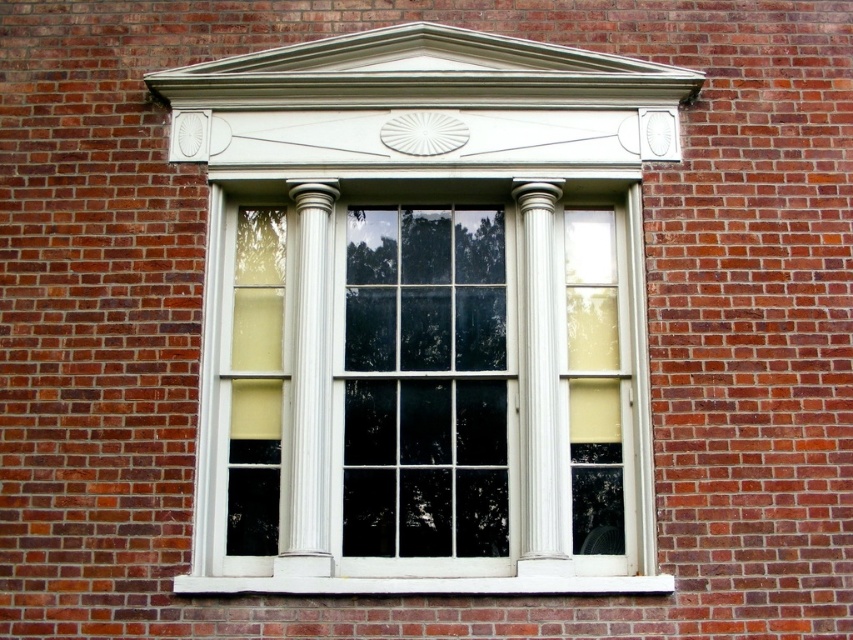
You are a painter standing on a ladder trying to paint the white glossy wood bay window at center and the white painted wood at lower center. The ladder can only reach up to 12 feet. Can you paint both areas without moving the ladder?

The distance between the white glossy wood bay window at center and the white painted wood at lower center is 13.78 feet, which exceeds the ladder height of 12 feet. Therefore, you cannot paint both areas without moving the ladder.

Looking at this image, you are standing at the camera position and want to take a photo of the white glossy wood bay window at center. If your camera has a maximum focus range of 70 feet, will you be able to focus on the window?

The distance between the white glossy wood bay window at center and the camera is 77.34 feet, which exceeds the camera maximum focus range of 70 feet. Therefore, you will not be able to focus on the window.

You are an architect examining the brick building. You notice the white glossy column at center and the white painted wood at lower center. Which one is positioned to the left side?

The white glossy column at center is positioned to the left of the white painted wood at lower center.